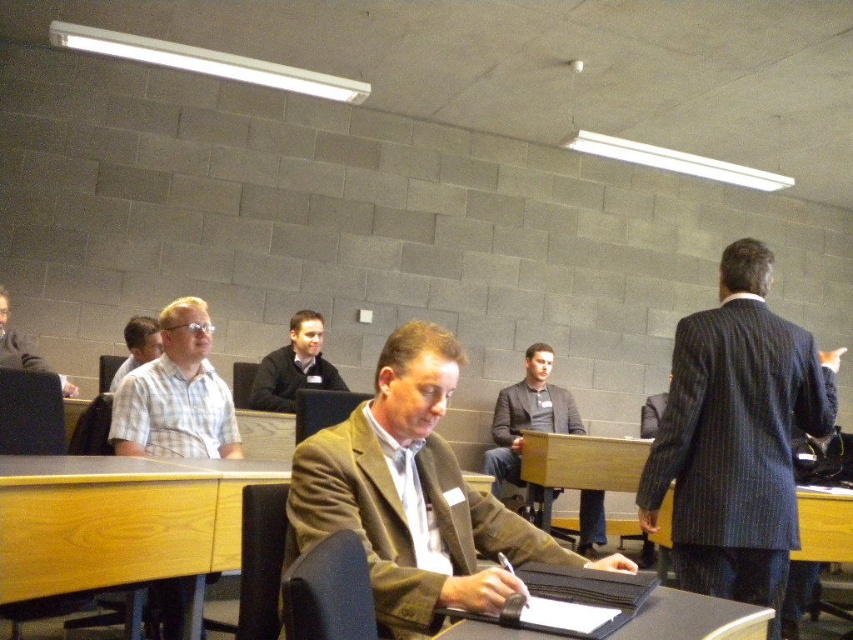
Does dark gray suit at center appear over light brown wood chair at left?

Actually, dark gray suit at center is below light brown wood chair at left.

Is point (531, 349) more distant than point (16, 360)?

Yes, point (531, 349) is behind point (16, 360).

You are a GUI agent. You are given a task and a screenshot of the screen. Output one action in this format:
    pyautogui.click(x=<x>, y=<y>)
    Task: Click on the dark gray suit at center
    Image resolution: width=853 pixels, height=640 pixels.
    Given the screenshot: What is the action you would take?
    pyautogui.click(x=526, y=417)

The width and height of the screenshot is (853, 640). In order to click on dark gray suit at center in this screenshot , I will do `click(526, 417)`.

Between brown woolen suit at center and light brown wood chair at left, which one has more height?

Standing taller between the two is light brown wood chair at left.

Does point (384, 461) lie in front of point (6, 321)?

Yes.

Which is in front, point (447, 358) or point (68, 396)?

Positioned in front is point (447, 358).

Locate an element on the screen. The image size is (853, 640). brown woolen suit at center is located at coordinates (415, 497).

Which is below, brown woolen suit at center or wooden desk at center?

wooden desk at center

Which is in front, point (408, 460) or point (64, 458)?

Positioned in front is point (408, 460).

Who is more distant from viewer, (412, 397) or (264, 472)?

The point (264, 472) is behind.

At what (x,y) coordinates should I click in order to perform the action: click on brown woolen suit at center. Please return your answer as a coordinate pair (x, y). Looking at the image, I should click on (415, 497).